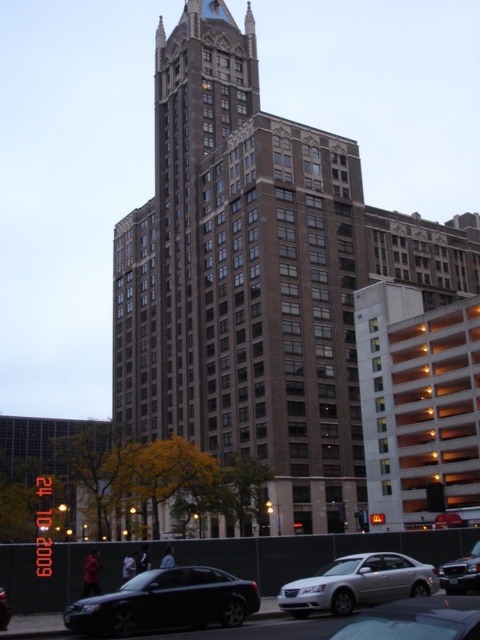
Does silver metallic sedan at lower center come behind shiny black sedan at center?

No, silver metallic sedan at lower center is closer to the viewer.

Locate an element on the screen. This screenshot has height=640, width=480. silver metallic sedan at lower center is located at coordinates (358, 582).

Where is `silver metallic sedan at lower center`? This screenshot has width=480, height=640. silver metallic sedan at lower center is located at coordinates (358, 582).

In the scene shown: Can you confirm if brown brick building at center is positioned below shiny black sedan at center?

No, brown brick building at center is not below shiny black sedan at center.

Is brown brick building at center shorter than shiny black sedan at center?

Incorrect, brown brick building at center's height does not fall short of shiny black sedan at center's.

Is point (315, 266) farther from viewer compared to point (1, 620)?

Yes.

Where is `brown brick building at center`? brown brick building at center is located at coordinates point(259,275).

Is shiny black sedan at lower left positioned before metallic silver sedan at lower center?

That is False.

Which is behind, point (197, 570) or point (466, 625)?

The point (197, 570) is behind.

Measure the distance between point (190, 588) and camera.

They are 100.23 feet apart.

This screenshot has height=640, width=480. Find the location of `shiny black sedan at lower left`. shiny black sedan at lower left is located at coordinates (166, 602).